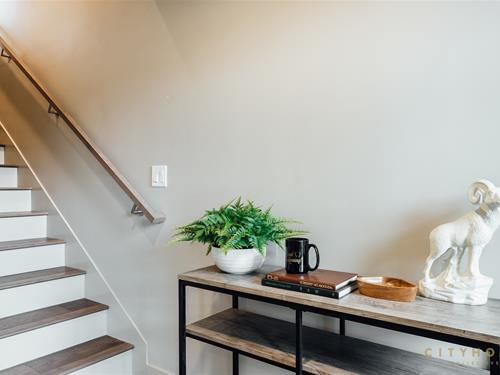
At what (x,y) coordinates should I click in order to perform the action: click on light switch. Please return your answer as a coordinate pair (x, y). This screenshot has width=500, height=375. Looking at the image, I should click on (160, 177).